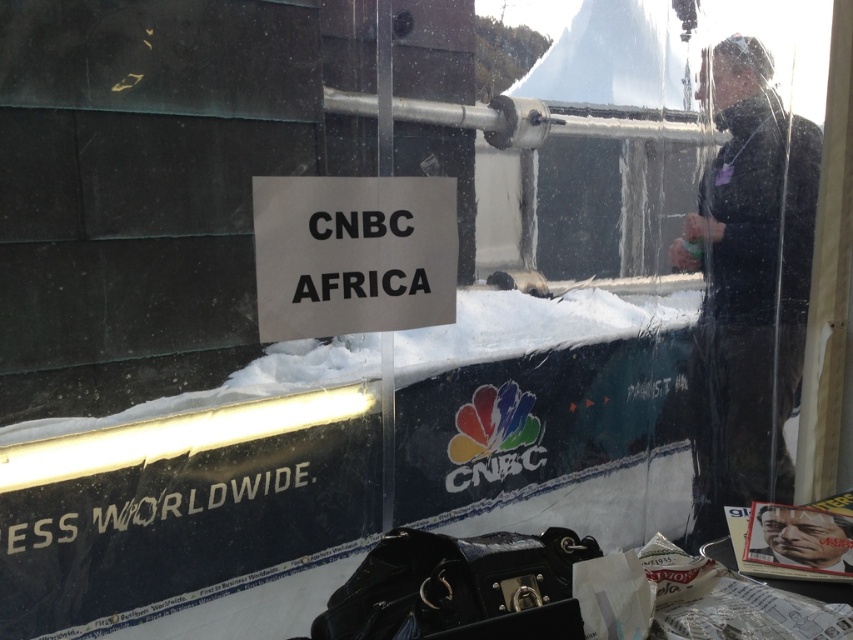
Who is more distant from viewer, (720, 435) or (810, 524)?

The point (720, 435) is more distant.

The image size is (853, 640). I want to click on black matte jacket at right, so coord(747,288).

Can you confirm if black matte jacket at right is positioned to the right of black paper sign at center?

Correct, you'll find black matte jacket at right to the right of black paper sign at center.

Does black matte jacket at right appear on the left side of black paper sign at center?

Incorrect, black matte jacket at right is not on the left side of black paper sign at center.

Between point (767, 262) and point (352, 288), which one is positioned in front?

Positioned in front is point (352, 288).

This screenshot has height=640, width=853. Identify the location of black matte jacket at right. (747, 288).

Can you confirm if transparent plastic at upper right is positioned to the right of black paper sign at center?

Indeed, transparent plastic at upper right is positioned on the right side of black paper sign at center.

Is point (822, 90) positioned behind point (415, 288)?

Yes, it is behind point (415, 288).

Identify the location of transparent plastic at upper right. (582, 205).

Where is `transparent plastic at upper right`? This screenshot has width=853, height=640. transparent plastic at upper right is located at coordinates (582, 205).